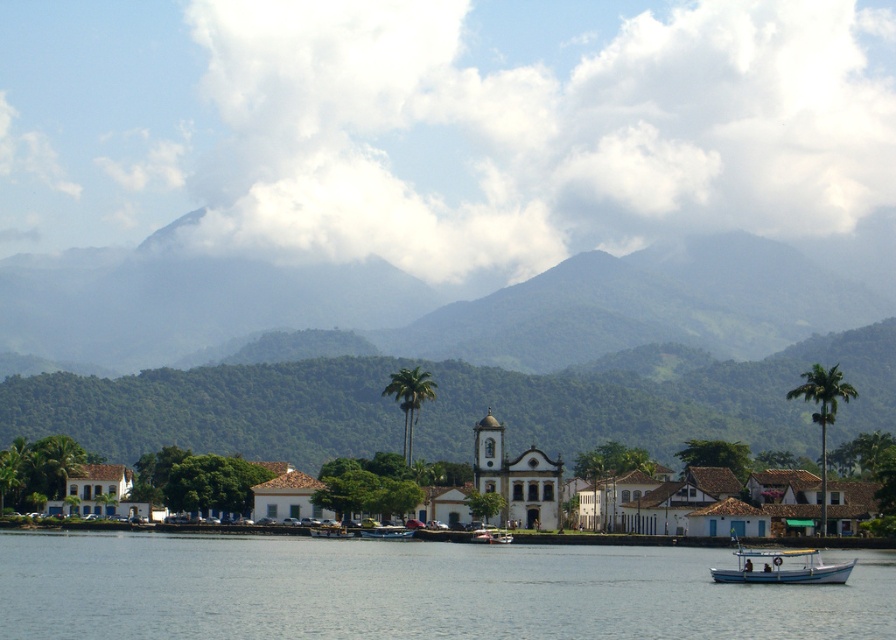
Based on the photo, can you confirm if white matte building at center is positioned below metallic blue boat at center?

Actually, white matte building at center is above metallic blue boat at center.

Can you confirm if white matte building at center is thinner than metallic blue boat at center?

In fact, white matte building at center might be wider than metallic blue boat at center.

Which is behind, point (702, 529) or point (385, 531)?

Positioned behind is point (385, 531).

At what (x,y) coordinates should I click in order to perform the action: click on white matte building at center. Please return your answer as a coordinate pair (x, y). Looking at the image, I should click on (210, 420).

Is white matte boat at lower right smaller than green leafy palm tree at center?

Yes, white matte boat at lower right is smaller than green leafy palm tree at center.

Which of these two, white matte boat at lower right or green leafy palm tree at center, stands shorter?

white matte boat at lower right

What do you see at coordinates (782, 566) in the screenshot? I see `white matte boat at lower right` at bounding box center [782, 566].

Where is `white matte boat at lower right`? white matte boat at lower right is located at coordinates (782, 566).

Who is shorter, green leafy mountain at center or metallic blue boat at center?

metallic blue boat at center

Does green leafy mountain at center have a greater width compared to metallic blue boat at center?

Correct, the width of green leafy mountain at center exceeds that of metallic blue boat at center.

Is point (605, 424) more distant than point (372, 532)?

That is True.

The height and width of the screenshot is (640, 896). Identify the location of green leafy mountain at center. (489, 356).